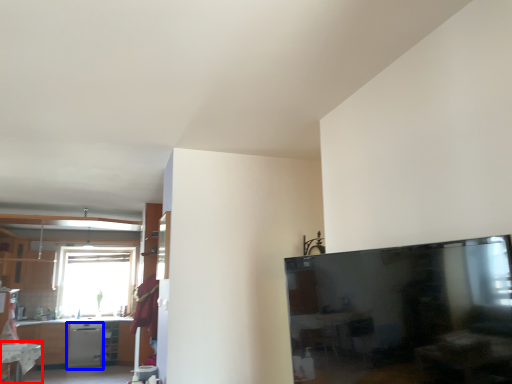
Question: Which point is further to the camera, table (highlighted by a red box) or dish washer (highlighted by a blue box)?

Choices:
 (A) table
 (B) dish washer

Answer: (B)